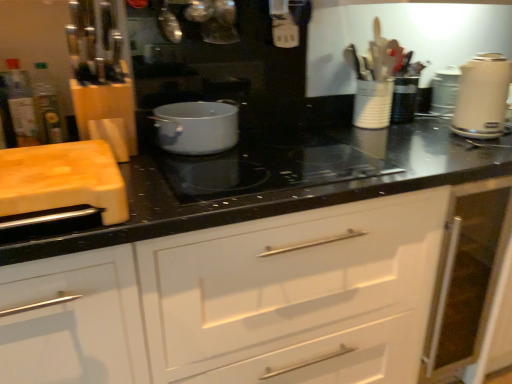
Question: Is translucent plastic bottle at left, which appears as the 1th bottle when viewed from the left, to the right of translucent glass bottle at left, the 2th bottle in the left-to-right sequence, from the viewer's perspective?

Choices:
 (A) yes
 (B) no

Answer: (B)

Question: Considering the relative positions of translucent plastic bottle at left, arranged as the 2th bottle when viewed from the right, and translucent glass bottle at left, the 2th bottle in the left-to-right sequence, in the image provided, is translucent plastic bottle at left, arranged as the 2th bottle when viewed from the right, to the left of translucent glass bottle at left, the 2th bottle in the left-to-right sequence, from the viewer's perspective?

Choices:
 (A) no
 (B) yes

Answer: (B)

Question: Could you tell me if translucent plastic bottle at left, which appears as the 1th bottle when viewed from the left, is facing translucent glass bottle at left, the 2th bottle in the left-to-right sequence?

Choices:
 (A) yes
 (B) no

Answer: (B)

Question: Is the position of translucent plastic bottle at left, arranged as the 2th bottle when viewed from the right, more distant than that of translucent glass bottle at left, placed as the 1th bottle when sorted from right to left?

Choices:
 (A) no
 (B) yes

Answer: (A)

Question: Considering the relative sizes of translucent plastic bottle at left, which appears as the 1th bottle when viewed from the left, and translucent glass bottle at left, the 2th bottle in the left-to-right sequence, in the image provided, is translucent plastic bottle at left, which appears as the 1th bottle when viewed from the left, wider than translucent glass bottle at left, the 2th bottle in the left-to-right sequence,?

Choices:
 (A) no
 (B) yes

Answer: (B)

Question: From the image's perspective, relative to matte white pot at center, placed as the first kitchen appliance when sorted from left to right, is translucent plastic bottle at left, arranged as the 2th bottle when viewed from the right, above or below?

Choices:
 (A) above
 (B) below

Answer: (A)

Question: From a real-world perspective, is translucent plastic bottle at left, arranged as the 2th bottle when viewed from the right, physically located above or below matte white pot at center, placed as the first kitchen appliance when sorted from left to right?

Choices:
 (A) below
 (B) above

Answer: (B)

Question: Do you think translucent plastic bottle at left, which appears as the 1th bottle when viewed from the left, is within matte white pot at center, which appears as the second kitchen appliance when viewed from the right, or outside of it?

Choices:
 (A) outside
 (B) inside

Answer: (A)

Question: Is point (10, 77) closer or farther from the camera than point (201, 100)?

Choices:
 (A) closer
 (B) farther

Answer: (A)

Question: From their relative heights in the image, would you say metallic silver kettle at upper center, positioned as the 1th appliance in front-to-back order, is taller or shorter than wooden cutting board at left?

Choices:
 (A) short
 (B) tall

Answer: (B)

Question: From the image's perspective, relative to wooden cutting board at left, is metallic silver kettle at upper center, positioned as the 1th appliance in front-to-back order, above or below?

Choices:
 (A) above
 (B) below

Answer: (A)

Question: Looking at their shapes, would you say metallic silver kettle at upper center, positioned as the third appliance in back-to-front order, is wider or thinner than wooden cutting board at left?

Choices:
 (A) thin
 (B) wide

Answer: (A)

Question: From a real-world perspective, is metallic silver kettle at upper center, arranged as the third appliance when viewed from the right, physically located above or below wooden cutting board at left?

Choices:
 (A) below
 (B) above

Answer: (B)

Question: Considering their positions, is white ceramic utensil holder at upper right, the second appliance positioned from the back, located in front of or behind metallic silver kettle at upper center, positioned as the 1th appliance in front-to-back order?

Choices:
 (A) behind
 (B) front

Answer: (A)

Question: In terms of height, does white ceramic utensil holder at upper right, the second appliance positioned from the back, look taller or shorter compared to metallic silver kettle at upper center, which appears as the 1th appliance when viewed from the left?

Choices:
 (A) tall
 (B) short

Answer: (B)